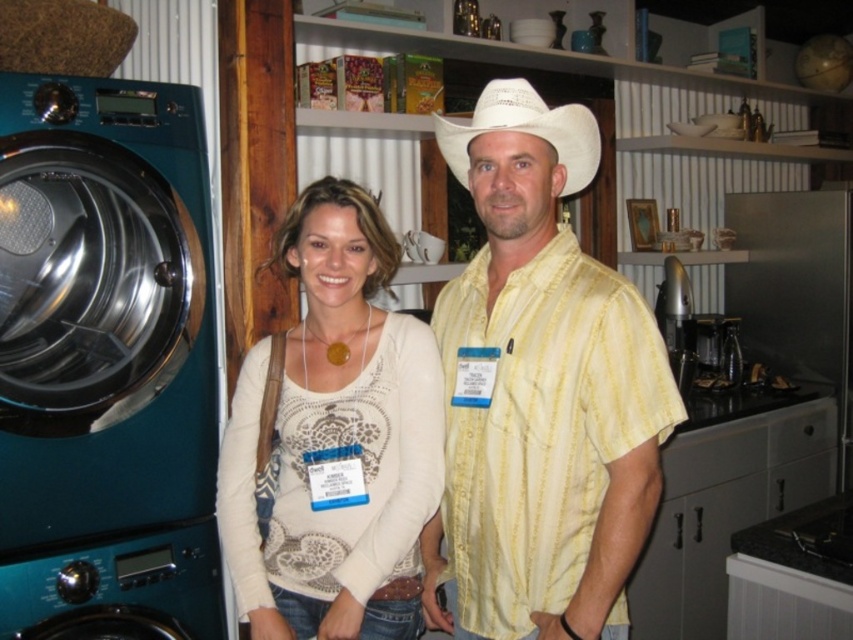
Is teal glossy washing machine at left positioned before white woven cowboy hat at center?

No.

Which is behind, point (122, 132) or point (589, 180)?

Point (122, 132)

Is point (100, 456) farther from viewer compared to point (492, 112)?

Yes.

You are a GUI agent. You are given a task and a screenshot of the screen. Output one action in this format:
    pyautogui.click(x=<x>, y=<y>)
    Task: Click on the teal glossy washing machine at left
    Image resolution: width=853 pixels, height=640 pixels.
    Given the screenshot: What is the action you would take?
    pyautogui.click(x=103, y=308)

Is teal glossy washing machine at left bigger than white lace sweater at center?

No.

Between point (62, 314) and point (393, 564), which one is positioned behind?

Point (62, 314)

Locate an element on the screen. teal glossy washing machine at left is located at coordinates (103, 308).

Does yellow striped shirt at center appear over white woven cowboy hat at center?

No.

Between yellow striped shirt at center and white woven cowboy hat at center, which one appears on the left side from the viewer's perspective?

Positioned to the left is white woven cowboy hat at center.

Describe the element at coordinates (540, 392) in the screenshot. I see `yellow striped shirt at center` at that location.

This screenshot has height=640, width=853. What are the coordinates of `yellow striped shirt at center` in the screenshot? It's located at (540, 392).